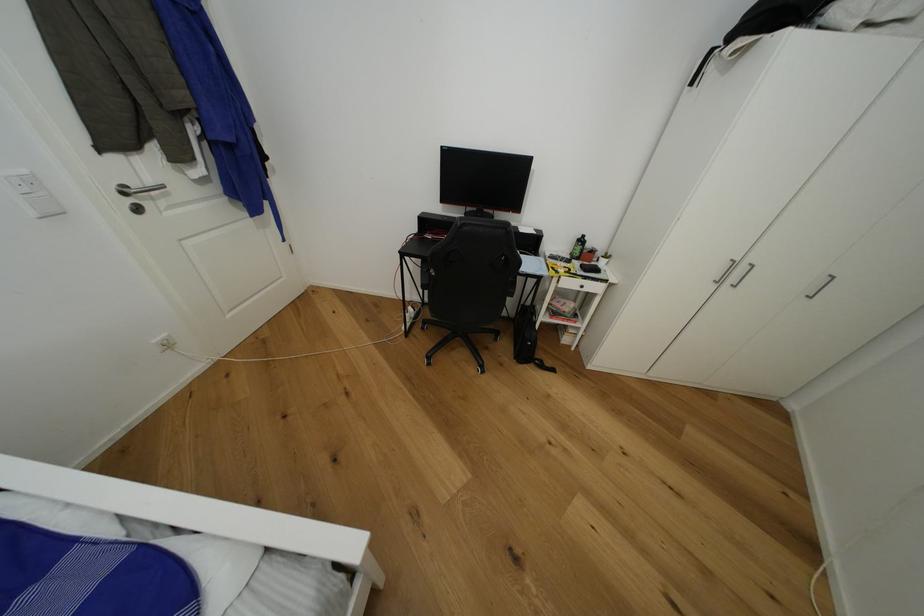
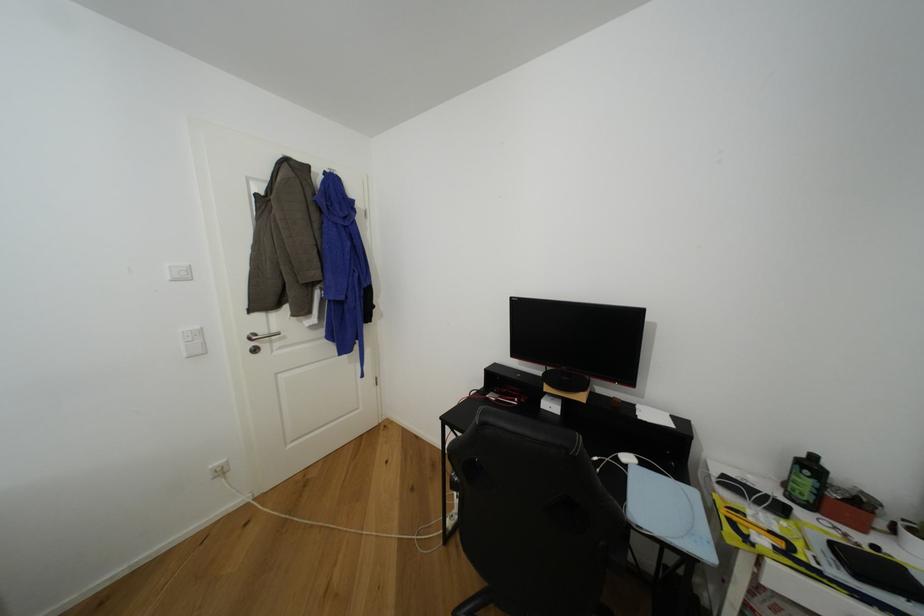
The point at [589,238] is marked in the first image. Where is the corresponding point in the second image?

(820, 459)